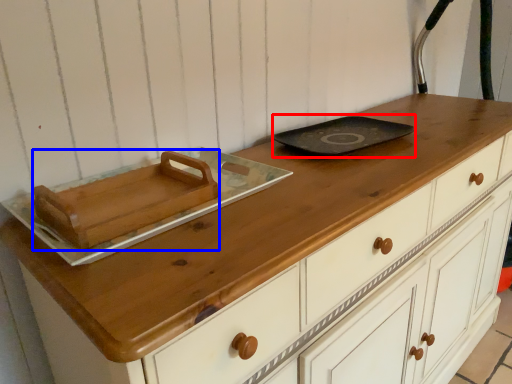
Question: Which of the following is the farthest to the observer, frying pan (highlighted by a red box) or food (highlighted by a blue box)?

Choices:
 (A) frying pan
 (B) food

Answer: (A)